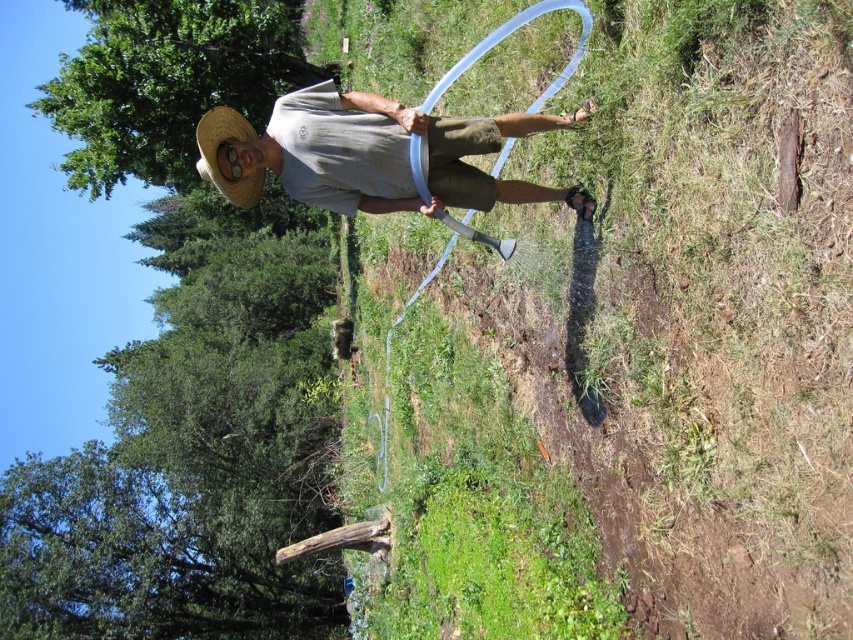
You are a gardener who wants to water the plants in the trench. The trench is located at point 0.6, 0.7. Can you reach the trench with the translucent plastic hose at center?

The translucent plastic hose at center is located at point (630, 358), which is very close to the trench at (596, 384). Therefore, the hose can reach the trench.